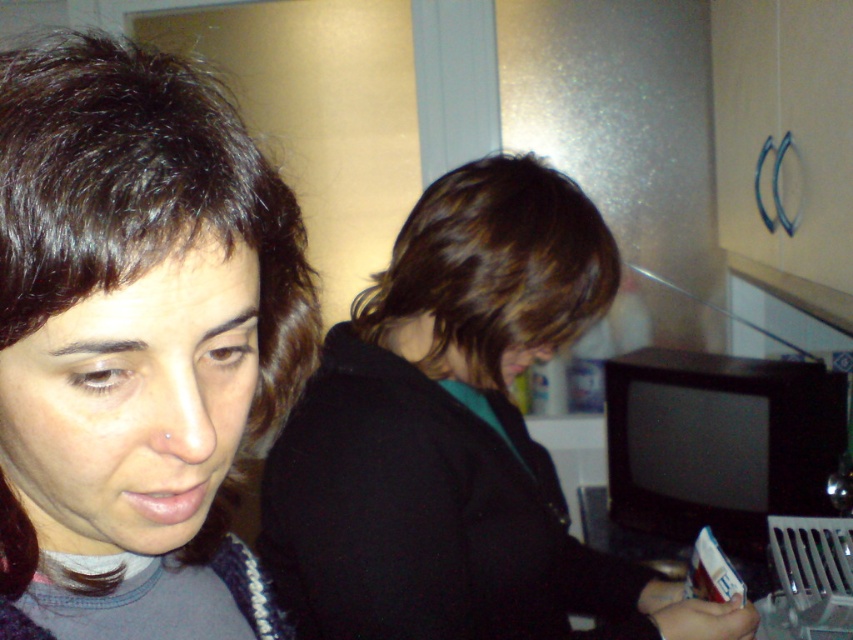
Question: Which object appears closest to the camera in this image?

Choices:
 (A) dark brown hair at upper left
 (B) dark brown hair at center

Answer: (A)

Question: Does dark brown hair at upper left lie in front of dark brown hair at center?

Choices:
 (A) yes
 (B) no

Answer: (A)

Question: Is the position of dark brown hair at upper left less distant than that of dark brown hair at center?

Choices:
 (A) no
 (B) yes

Answer: (B)

Question: Which point appears closest to the camera in this image?

Choices:
 (A) (614, 602)
 (B) (71, 184)

Answer: (B)

Question: Can you confirm if dark brown hair at upper left is smaller than dark brown hair at center?

Choices:
 (A) no
 (B) yes

Answer: (B)

Question: Among these objects, which one is farthest from the camera?

Choices:
 (A) dark brown hair at upper left
 (B) dark brown hair at center

Answer: (B)